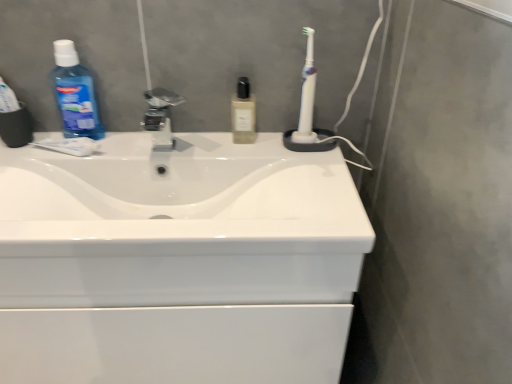
This screenshot has height=384, width=512. What are the coordinates of `free space to the left of blue translucent mouthwash at left` in the screenshot? It's located at (42, 141).